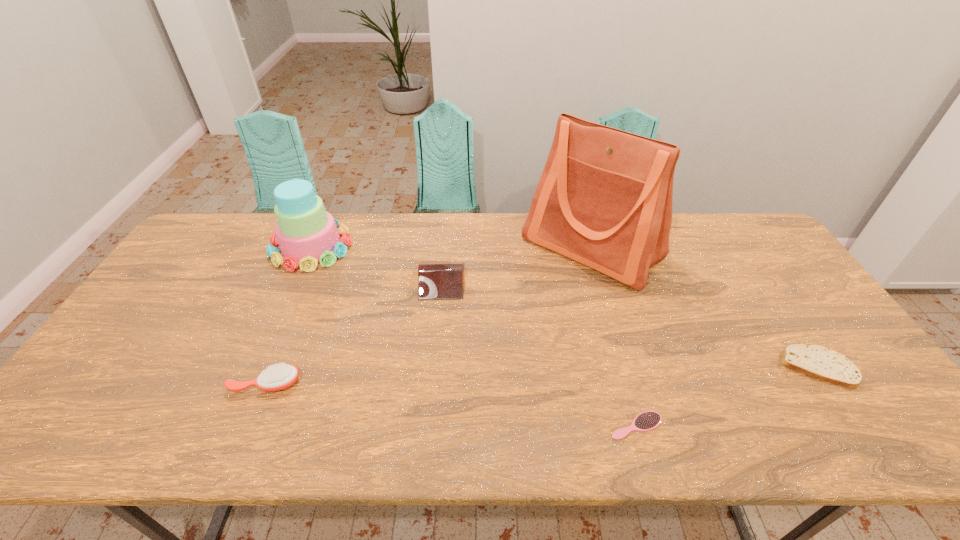
Locate an element on the screen. This screenshot has height=540, width=960. free space at the near edge of the desktop is located at coordinates (160, 435).

This screenshot has width=960, height=540. Identify the location of vacant space at the near left corner of the desktop. (55, 420).

Locate an element on the screen. blank area at the far right corner is located at coordinates (741, 214).

You are a GUI agent. You are given a task and a screenshot of the screen. Output one action in this format:
    pyautogui.click(x=<x>, y=<y>)
    Task: Click on the free space between the shorter hairbrush and the third object from left to right
    The width and height of the screenshot is (960, 540).
    Given the screenshot: What is the action you would take?
    pyautogui.click(x=540, y=353)

This screenshot has width=960, height=540. What are the coordinates of `vacant area that lies between the book and the left hairbrush` in the screenshot? It's located at (354, 332).

You are a GUI agent. You are given a task and a screenshot of the screen. Output one action in this format:
    pyautogui.click(x=<x>, y=<y>)
    Task: Click on the free point between the second tallest object and the nearer hairbrush
    This screenshot has height=540, width=960.
    Given the screenshot: What is the action you would take?
    pyautogui.click(x=473, y=336)

Find the location of a particular element. Image resolution: width=960 pixels, height=540 pixels. vacant space that is in between the tallest object and the third tallest object is located at coordinates (516, 265).

Where is `blank region between the fourth object from right to left and the second shortest object`? The image size is (960, 540). blank region between the fourth object from right to left and the second shortest object is located at coordinates (629, 323).

The image size is (960, 540). I want to click on free space between the fourth object from right to left and the right hairbrush, so [x=540, y=353].

This screenshot has width=960, height=540. In order to click on vacant area that lies between the fifth shortest object and the third shortest object in this screenshot , I will do `click(288, 315)`.